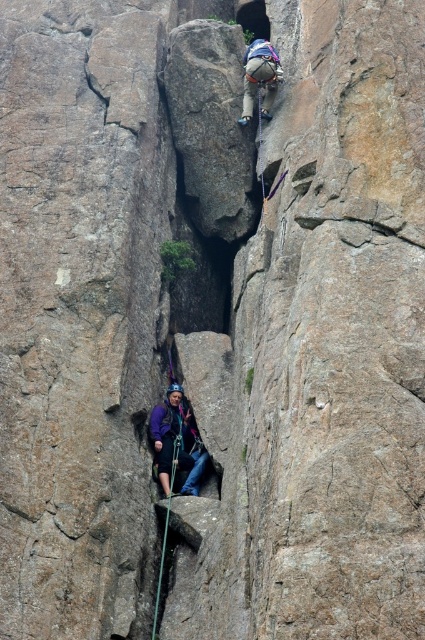
You are a rock climber assessing the safety of the equipment in the crevice. You notice the matte gray helmet at upper center and the green nylon rope at center. Which piece of equipment is shorter?

The matte gray helmet at upper center is shorter than the green nylon rope at center.

You are a climber in the crevice and need to adjust your gear. You have the purple fabric at center and the matte gray helmet at upper center in your view. Which item is closer to you?

The purple fabric at center is closer to you because it is in front of the matte gray helmet at upper center.

You are a climber in the crevice and need to retrieve your gear. You see the purple fabric at center and the green nylon rope at center. Which object is closer to you?

The purple fabric at center is closer to you because the green nylon rope at center is behind it.